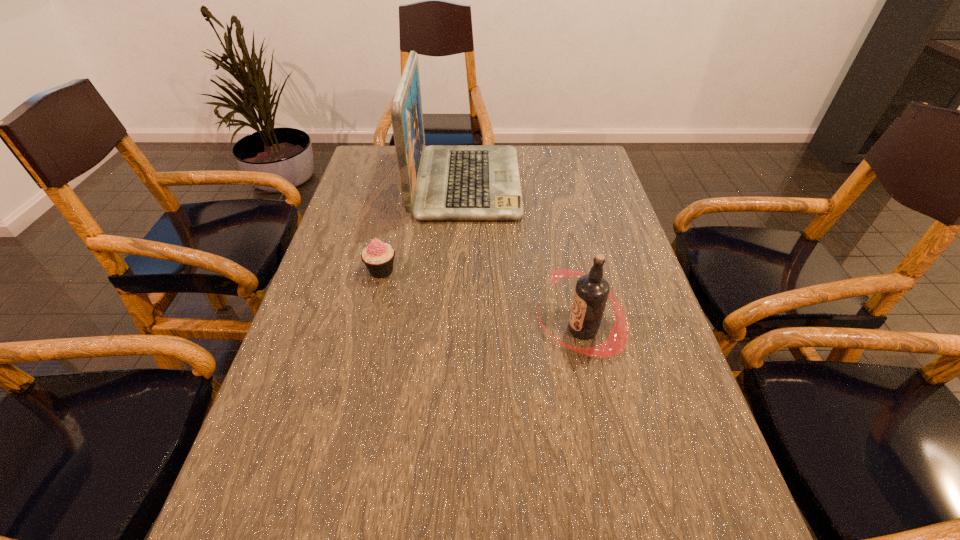
What are the coordinates of `the tallest object` in the screenshot? It's located at (440, 182).

Identify the location of the farthest object. (440, 182).

The width and height of the screenshot is (960, 540). What are the coordinates of `root beer` in the screenshot? It's located at (591, 293).

This screenshot has height=540, width=960. I want to click on the second tallest object, so click(x=591, y=293).

You are a GUI agent. You are given a task and a screenshot of the screen. Output one action in this format:
    pyautogui.click(x=<x>, y=<y>)
    Task: Click on the shortest object
    The image size is (960, 540).
    Given the screenshot: What is the action you would take?
    pyautogui.click(x=378, y=257)

The width and height of the screenshot is (960, 540). Find the location of `the second nearest object`. the second nearest object is located at coordinates (378, 257).

Find the location of a particular element. The width and height of the screenshot is (960, 540). vacant space situated on the screen of the farthest object is located at coordinates (578, 183).

Locate an element on the screen. free location located 0.070m on the label of the nearest object is located at coordinates click(x=507, y=329).

In order to click on vacant space situated 0.210m on the label of the nearest object in this screenshot , I will do `click(442, 329)`.

Locate an element on the screen. free space located 0.070m on the label of the nearest object is located at coordinates (507, 329).